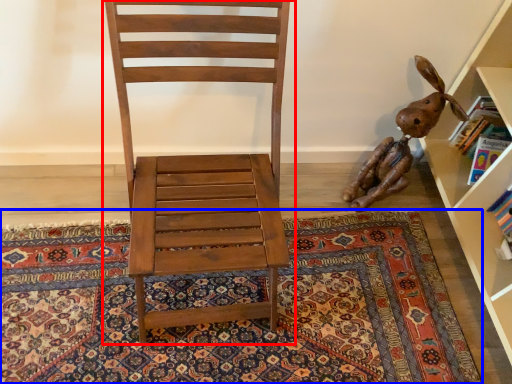
Question: Which object is closer to the camera taking this photo, chair (highlighted by a red box) or mat (highlighted by a blue box)?

Choices:
 (A) chair
 (B) mat

Answer: (A)